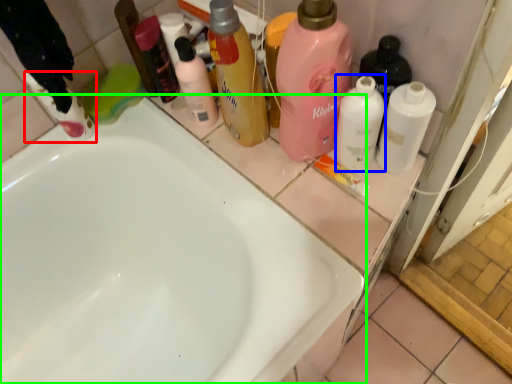
Question: Considering the real-world distances, which object is farthest from cleaning product (highlighted by a red box)? cleaning product (highlighted by a blue box) or bathtub (highlighted by a green box)?

Choices:
 (A) cleaning product
 (B) bathtub

Answer: (A)